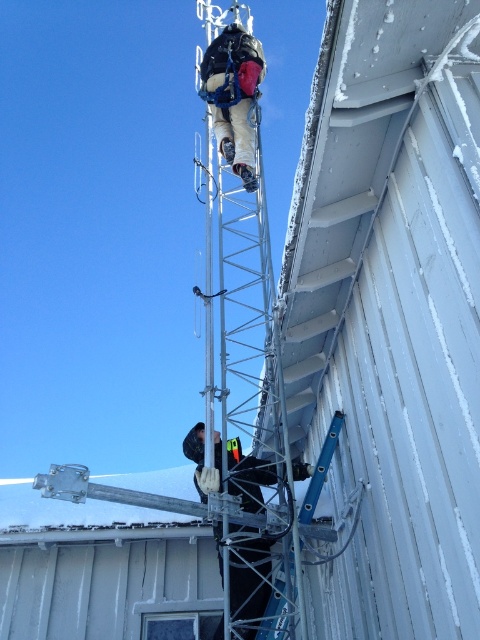
Between black fabric gloves at center and matte black harness at upper center, which one is positioned higher?

matte black harness at upper center

Is black fabric gloves at center thinner than matte black harness at upper center?

Incorrect, black fabric gloves at center's width is not less than matte black harness at upper center's.

Is point (233, 570) positioned after point (210, 65)?

No, it is not.

Where is `black fabric gloves at center`? The width and height of the screenshot is (480, 640). black fabric gloves at center is located at coordinates (250, 579).